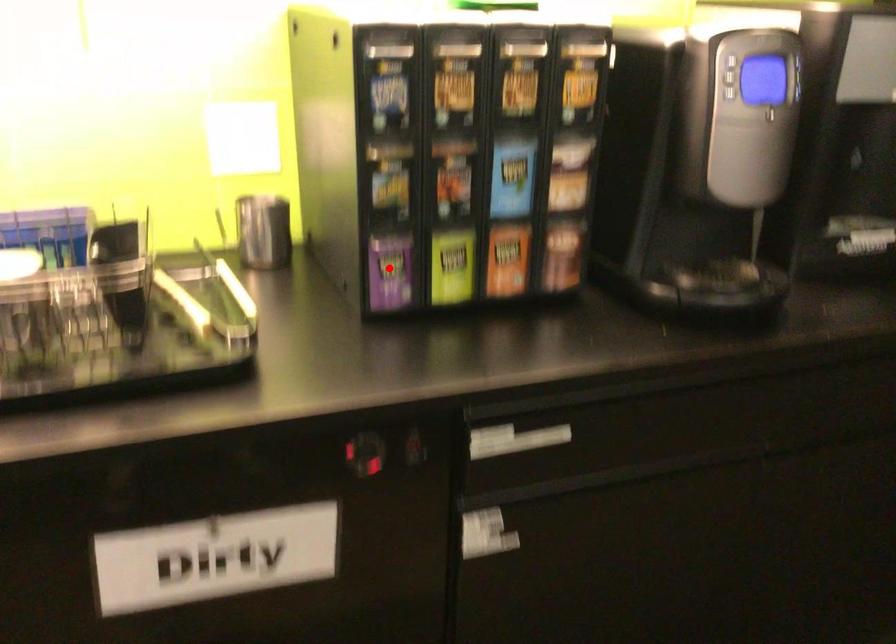
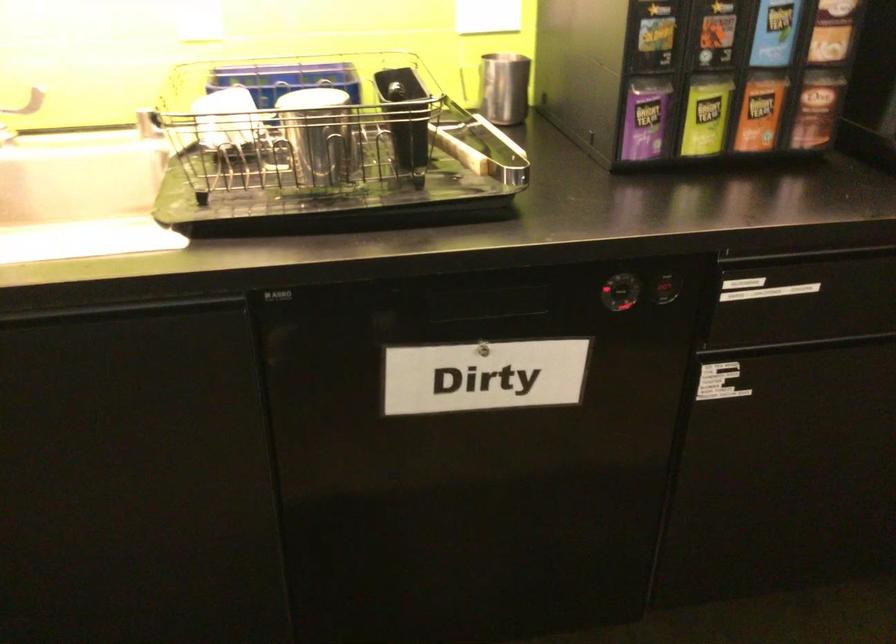
Question: I am providing you with two images of the same scene from different viewpoints. A red point is marked on the first image. At the location where the point appears in image 1, is it still visible in image 2?

Choices:
 (A) Yes
 (B) No

Answer: (A)